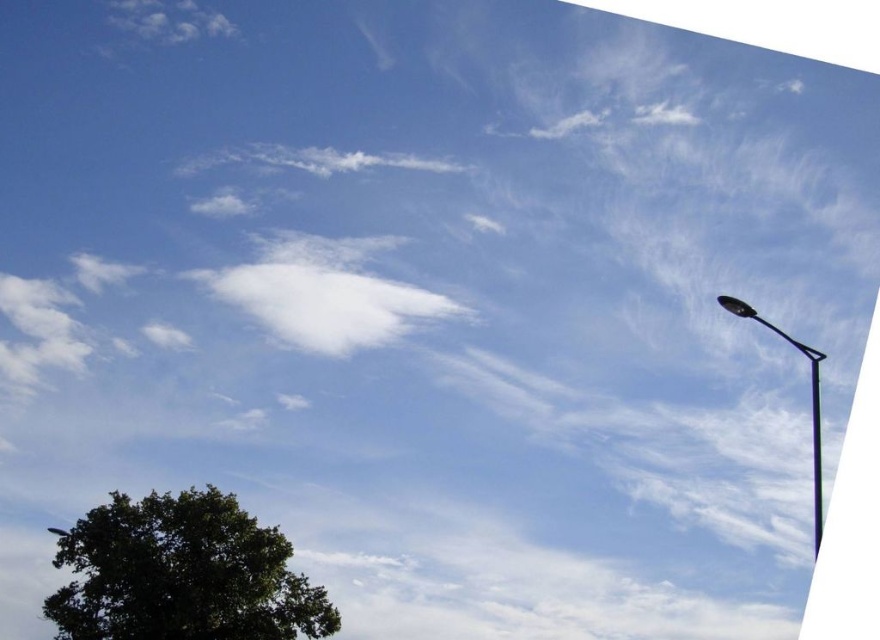
Question: Is green leafy tree at lower left to the right of black metal street light at right from the viewer's perspective?

Choices:
 (A) yes
 (B) no

Answer: (B)

Question: Is green leafy tree at lower left smaller than black metal street light at right?

Choices:
 (A) no
 (B) yes

Answer: (B)

Question: Observing the image, what is the correct spatial positioning of green leafy tree at lower left in reference to black metal street light at right?

Choices:
 (A) right
 (B) left

Answer: (B)

Question: Which object appears farthest from the camera in this image?

Choices:
 (A) green leafy tree at lower left
 (B) black metal street light at right

Answer: (A)

Question: Which point is farther to the camera?

Choices:
 (A) (816, 492)
 (B) (204, 486)

Answer: (B)

Question: Which point is closer to the camera?

Choices:
 (A) green leafy tree at lower left
 (B) black metal street light at right

Answer: (B)